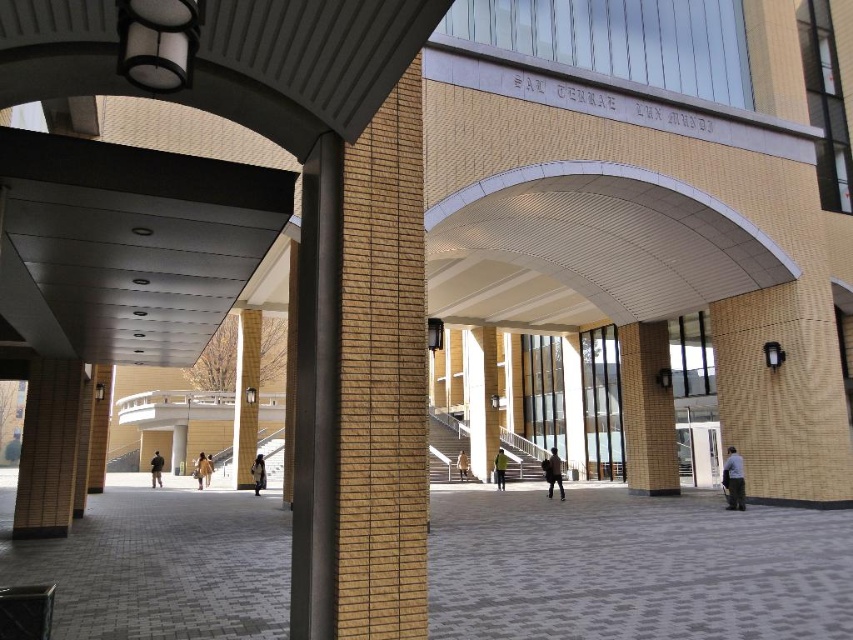
Question: Can you confirm if gray brick pavement at center is positioned to the left of dark gray pants at lower right?

Choices:
 (A) no
 (B) yes

Answer: (B)

Question: Among these objects, which one is nearest to the camera?

Choices:
 (A) light beige coat at center
 (B) brown leather jacket at center

Answer: (B)

Question: Where is dark gray pants at lower right located in relation to light brown fur coat at center in the image?

Choices:
 (A) below
 (B) above

Answer: (B)

Question: Considering the real-world distances, which object is farthest from the light brown leather jacket at center?

Choices:
 (A) light beige coat at center
 (B) brown leather jacket at center
 (C) light brown fur coat at center
 (D) dark blue jeans at center

Answer: (A)

Question: Which of the following is the closest to the observer?

Choices:
 (A) light brown fur coat at center
 (B) light brown leather jacket at center
 (C) yellow brick pillar at center

Answer: (B)

Question: Does gray brick pavement at center have a lesser width compared to dark blue jeans at center?

Choices:
 (A) no
 (B) yes

Answer: (A)